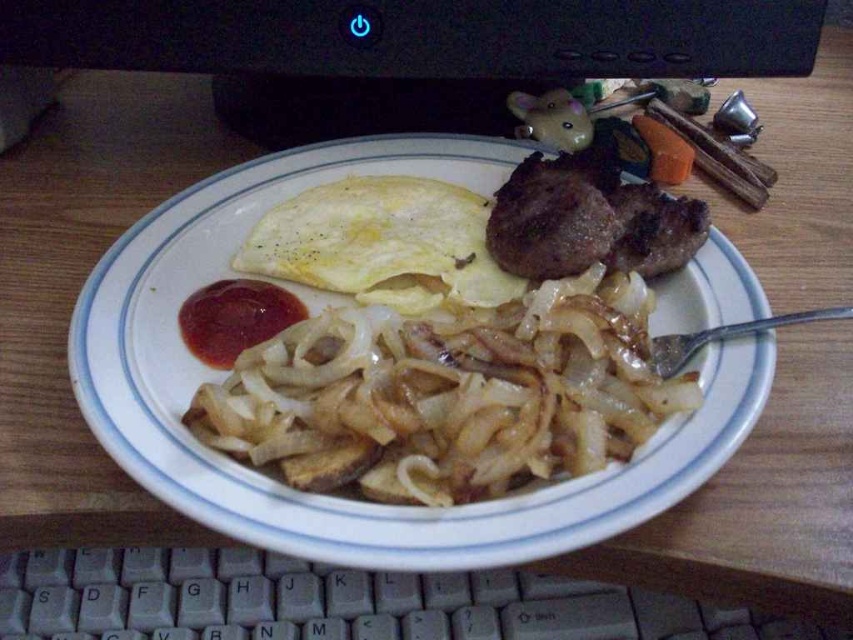
Who is more forward, (479, 605) or (662, 157)?

Point (479, 605) is in front.

From the picture: Is white plastic keyboard at lower center to the left of orange smooth carrot at upper right from the viewer's perspective?

Yes, white plastic keyboard at lower center is to the left of orange smooth carrot at upper right.

Measure the distance between white plastic keyboard at lower center and camera.

22.25 inches

Locate an element on the screen. white plastic keyboard at lower center is located at coordinates (335, 602).

Is point (190, 344) positioned after point (645, 145)?

No, (190, 344) is closer to viewer.

Can you confirm if red glossy ketchup at center is bigger than orange smooth carrot at upper right?

Incorrect, red glossy ketchup at center is not larger than orange smooth carrot at upper right.

Which is behind, point (242, 316) or point (665, 164)?

Positioned behind is point (665, 164).

I want to click on red glossy ketchup at center, so click(234, 317).

Identify the location of white glazed plate at center. (337, 499).

Which is below, white glazed plate at center or brown crispy meat at center?

white glazed plate at center is below.

You are a GUI agent. You are given a task and a screenshot of the screen. Output one action in this format:
    pyautogui.click(x=<x>, y=<y>)
    Task: Click on the white glazed plate at center
    
    Given the screenshot: What is the action you would take?
    pyautogui.click(x=337, y=499)